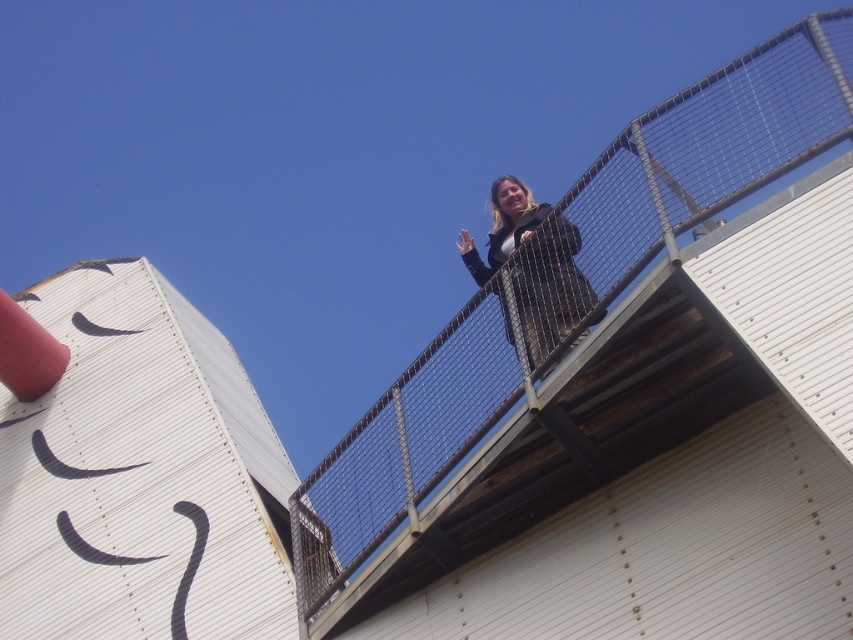
You are a drone operator trying to capture a photo of the metal mesh railing at upper center from your current position. The drone has a maximum range of 30 meters. Can you successfully take the photo without exceeding the drone range?

The metal mesh railing at upper center is 35.01 meters away from the viewer, which exceeds the drone range of 30 meters. Therefore, you cannot successfully take the photo without exceeding the drone range.

You are a painter who needs to place a 1.2 meter wide canvas between the metal mesh railing at upper center and the matte black jacket at upper center. Based on the scene description, will the canvas fit?

The metal mesh railing at upper center is wider than the matte black jacket at upper center, but the exact width difference isn not specified. However, since the canvas is 1.2 meters wide, it might not fit if the space between them is smaller than that. Without precise measurements, it is uncertain.

You are standing on the metal staircase and want to wave to someone below while holding onto the railing. Which object should you grab first to ensure you can reach both the matte black jacket at upper center and the metal mesh railing at upper center?

You should grab the matte black jacket at upper center first because the metal mesh railing at upper center is to the right of it, allowing you to reach both by moving your hand from the jacket to the railing.